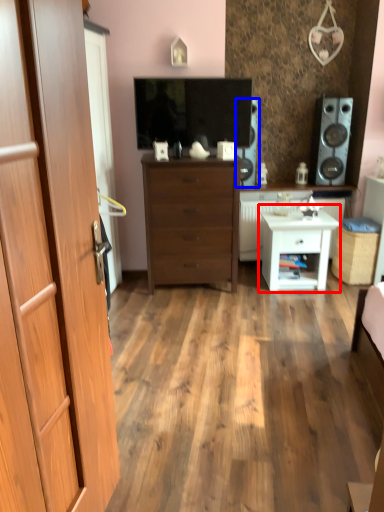
Question: Which of the following is the closest to the observer, nightstand (highlighted by a red box) or speaker (highlighted by a blue box)?

Choices:
 (A) nightstand
 (B) speaker

Answer: (A)